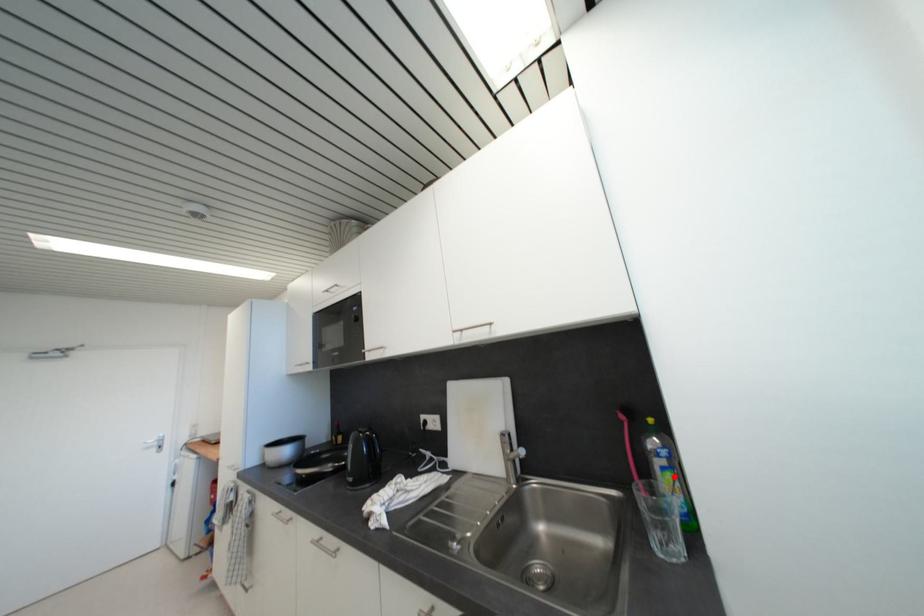
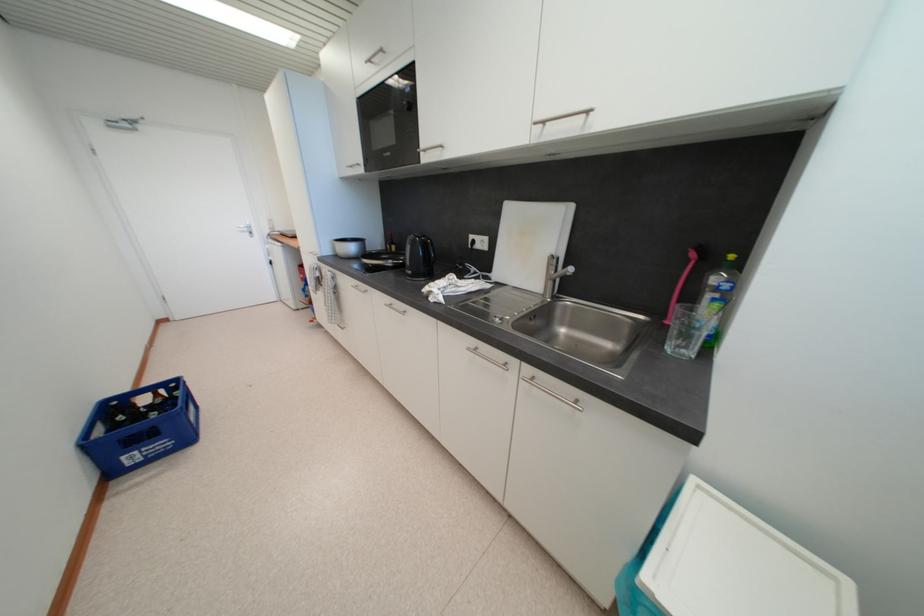
Where in the second image is the point corresponding to the highlighted location from the first image?

(723, 307)